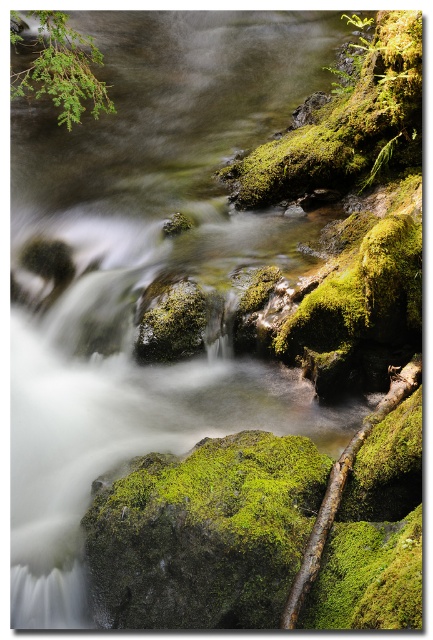
Is green mossy rock at upper right taller than green leafy branch at upper left?

Correct, green mossy rock at upper right is much taller as green leafy branch at upper left.

Who is more forward, (349, 92) or (83, 42)?

Positioned in front is point (349, 92).

Who is more forward, (374, 99) or (38, 77)?

Positioned in front is point (374, 99).

You are a GUI agent. You are given a task and a screenshot of the screen. Output one action in this format:
    pyautogui.click(x=<x>, y=<y>)
    Task: Click on the green mossy rock at upper right
    The width and height of the screenshot is (433, 640).
    Given the screenshot: What is the action you would take?
    pyautogui.click(x=346, y=124)